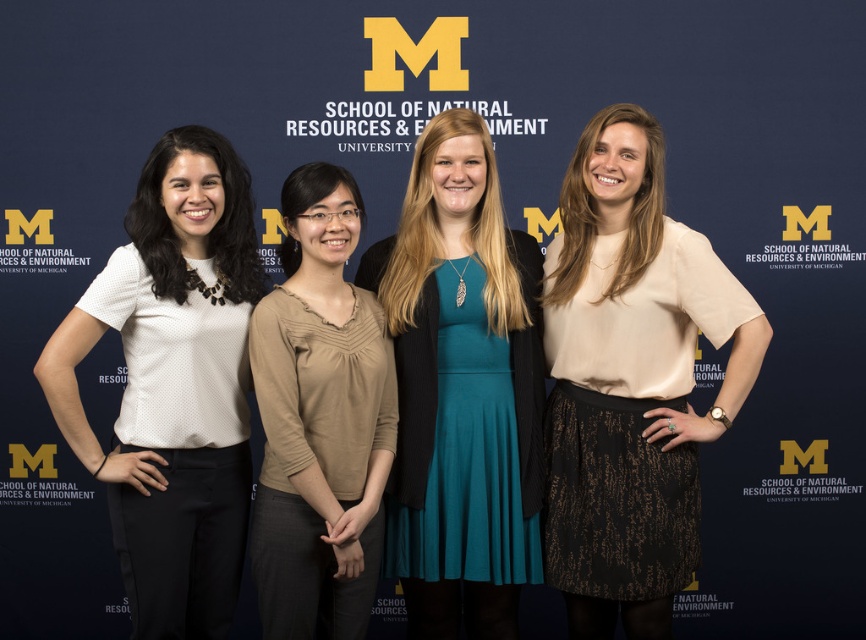
Question: Considering the real-world distances, which object is closest to the teal satin dress at center?

Choices:
 (A) white dotted blouse at left
 (B) matte beige blouse at center

Answer: (B)

Question: Is matte beige blouse at center to the left of teal satin dress at center from the viewer's perspective?

Choices:
 (A) no
 (B) yes

Answer: (A)

Question: Which point is farther to the camera?

Choices:
 (A) (485, 208)
 (B) (635, 336)
 (C) (367, 310)
 (D) (237, 291)

Answer: (A)

Question: Considering the real-world distances, which object is closest to the white dotted blouse at left?

Choices:
 (A) teal satin dress at center
 (B) matte beige blouse at center
 (C) tan soft fabric blouse at center

Answer: (C)

Question: Is white dotted blouse at left closer to camera compared to tan soft fabric blouse at center?

Choices:
 (A) no
 (B) yes

Answer: (B)

Question: Is matte beige blouse at center further to the viewer compared to teal satin dress at center?

Choices:
 (A) no
 (B) yes

Answer: (A)